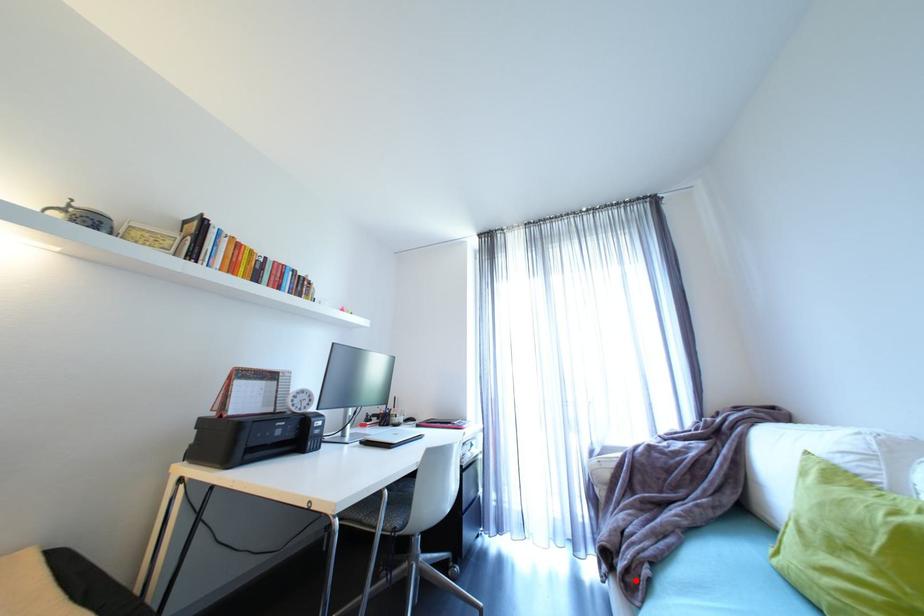
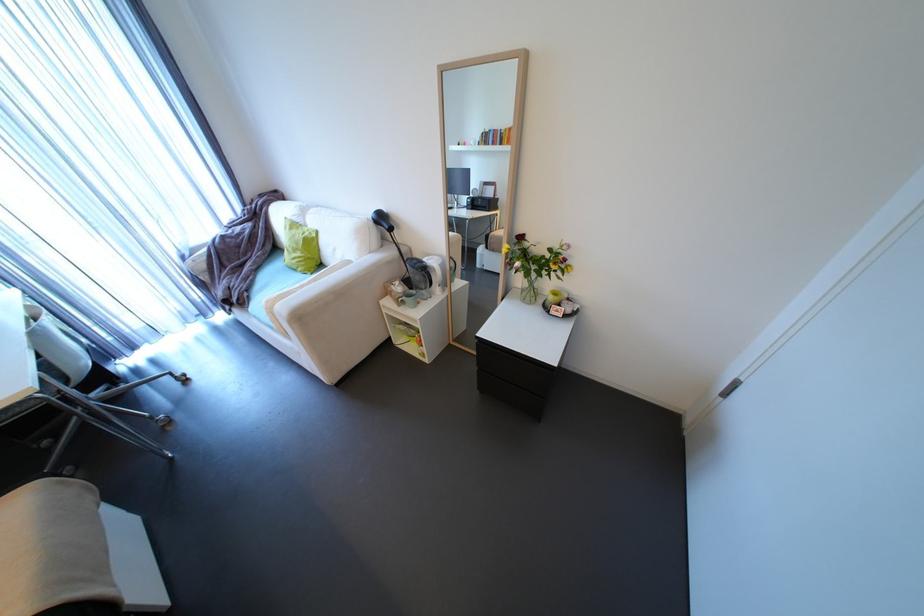
Question: A red point is marked in image1. In image2, is the corresponding 3D point closer to the camera or farther? Reply with the corresponding letter.

Choices:
 (A) The corresponding 3D point is closer.
 (B) The corresponding 3D point is farther.

Answer: (B)